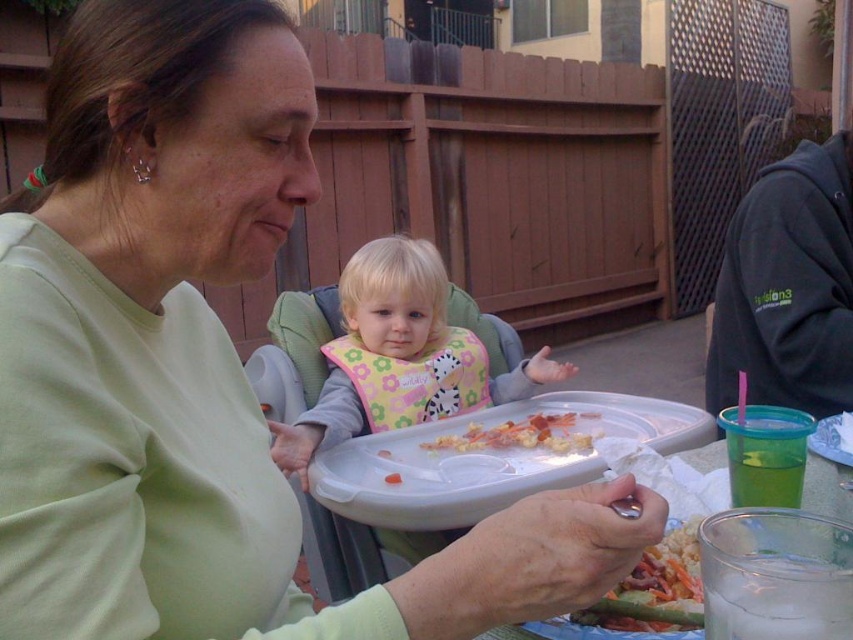
You are a parent trying to hand a shiny plastic fork at lower center to your child sitting in the high chair. The white plastic tray at center is in the way. Can you reach the fork without moving the tray?

The white plastic tray at center and shiny plastic fork at lower center are 26.05 inches apart from each other. Since the tray is blocking the path, you would need to move it to access the fork.

You are standing in the backyard and see the point at coordinates point (398, 513). If you want to place a small toy there, will you be able to reach it without moving closer?

The point (398, 513) is 1.20 meters away from the viewer. Since the toy is small, you can likely reach it without moving closer if your arm length is sufficient to cover the distance.

You are a photographer trying to capture the perfect shot of the floral fabric bib at center. If you want to focus your camera lens precisely on the exact coordinates where the bib is located, what are the coordinates you should aim for?

The coordinates for the floral fabric bib at center are at point (415, 380).